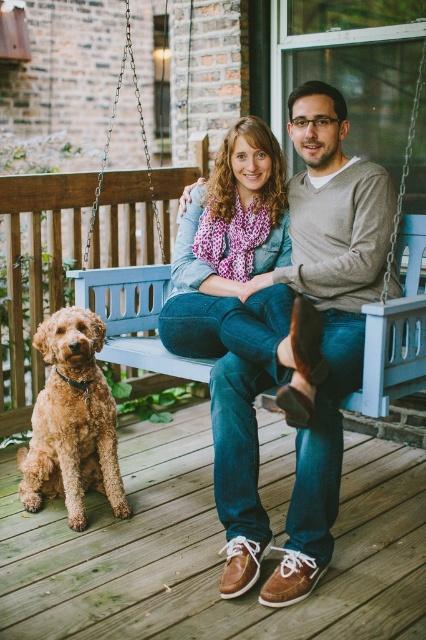
Question: Is brown leather shoes at lower center further to the viewer compared to brown suede shoes at center?

Choices:
 (A) no
 (B) yes

Answer: (A)

Question: Which of these objects is positioned closest to the blue wooden swing at center?

Choices:
 (A) golden fur dog at lower left
 (B) brown leather shoes at lower center

Answer: (A)

Question: Can you confirm if brown leather shoes at lower center is positioned to the right of blue wooden swing at center?

Choices:
 (A) yes
 (B) no

Answer: (A)

Question: Which object appears closest to the camera in this image?

Choices:
 (A) brown suede shoes at center
 (B) blue wooden swing at center
 (C) golden fur dog at lower left

Answer: (A)

Question: Which point is closer to the camera?

Choices:
 (A) brown leather shoes at lower center
 (B) brown suede shoes at center

Answer: (A)

Question: Is brown leather shoes at lower center thinner than brown suede shoes at center?

Choices:
 (A) yes
 (B) no

Answer: (B)